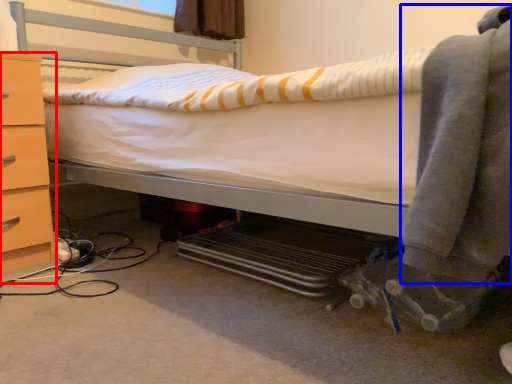
Question: Which point is further to the camera, chest of drawers (highlighted by a red box) or clothing (highlighted by a blue box)?

Choices:
 (A) chest of drawers
 (B) clothing

Answer: (A)